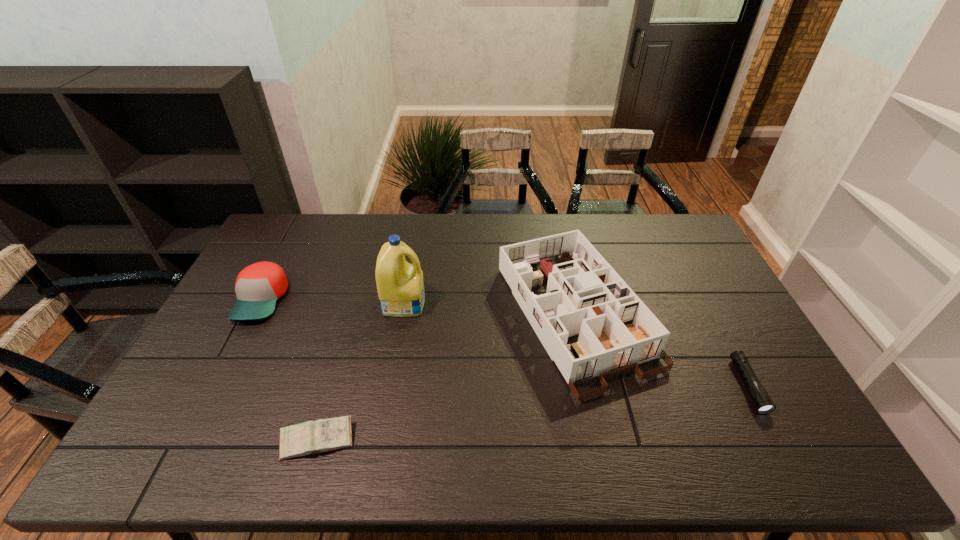
In order to click on vacant space located 0.250m on the back of the fourth tallest object in this screenshot , I will do `click(346, 343)`.

Locate an element on the screen. The image size is (960, 540). blank space located at the lens end of the flashlight is located at coordinates (779, 444).

Find the location of a particular element. object present at the far edge is located at coordinates (585, 296).

Where is `object located in the near edge section of the desktop`? object located in the near edge section of the desktop is located at coordinates (311, 437).

At what (x,y) coordinates should I click in order to perform the action: click on object that is at the left edge. Please return your answer as a coordinate pair (x, y). Looking at the image, I should click on (258, 286).

Where is `object that is at the right edge`? The image size is (960, 540). object that is at the right edge is located at coordinates (761, 400).

Where is `vacant area at the far edge of the desktop`? This screenshot has width=960, height=540. vacant area at the far edge of the desktop is located at coordinates (652, 249).

This screenshot has height=540, width=960. In order to click on vacant space at the near edge of the desktop in this screenshot , I will do `click(387, 446)`.

Image resolution: width=960 pixels, height=540 pixels. Identify the location of vacant space at the right edge of the desktop. (693, 320).

I want to click on free space at the far left corner of the desktop, so click(282, 250).